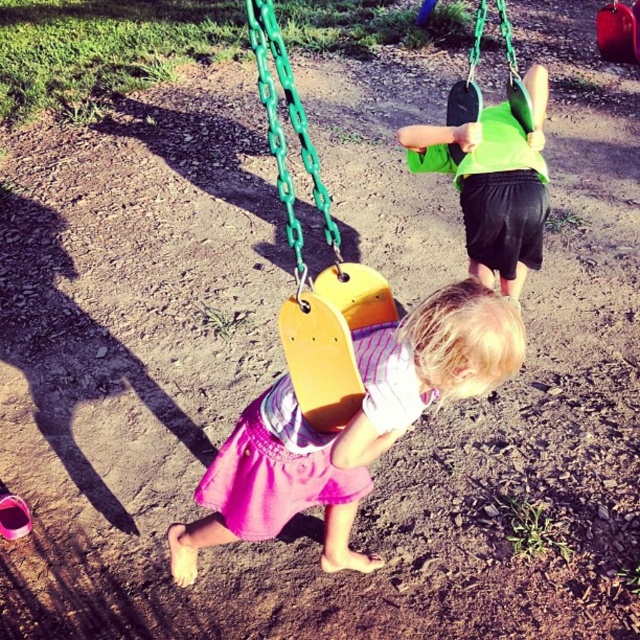
Question: Considering the relative positions of pink fabric skirt at center and green matte swing at upper center in the image provided, where is pink fabric skirt at center located with respect to green matte swing at upper center?

Choices:
 (A) right
 (B) left

Answer: (B)

Question: Can you confirm if pink fabric skirt at center is positioned to the right of green matte swing at upper center?

Choices:
 (A) yes
 (B) no

Answer: (B)

Question: Which object is farther from the camera taking this photo?

Choices:
 (A) green matte swing at upper center
 (B) pink fabric skirt at center

Answer: (A)

Question: Which of the following is the closest to the observer?

Choices:
 (A) (410, 381)
 (B) (483, 204)

Answer: (A)

Question: Does pink fabric skirt at center appear on the left side of green matte swing at upper center?

Choices:
 (A) yes
 (B) no

Answer: (A)